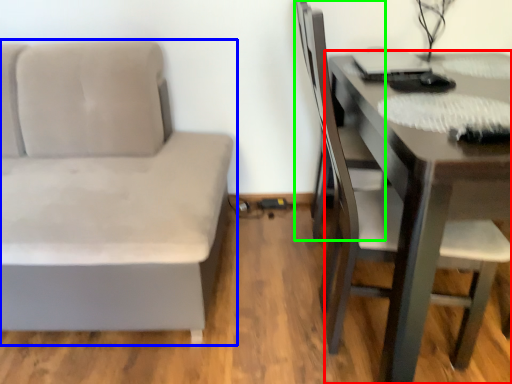
Question: Which is farther away from table (highlighted by a red box)? studio couch (highlighted by a blue box) or swivel chair (highlighted by a green box)?

Choices:
 (A) studio couch
 (B) swivel chair

Answer: (A)